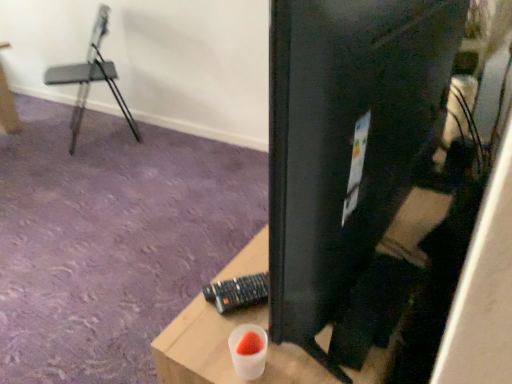
Locate an element on the screen. This screenshot has width=512, height=384. metallic gray armchair at left is located at coordinates 90,79.

Describe the element at coordinates (90, 79) in the screenshot. I see `metallic gray armchair at left` at that location.

The height and width of the screenshot is (384, 512). I want to click on metallic gray armchair at left, so click(x=90, y=79).